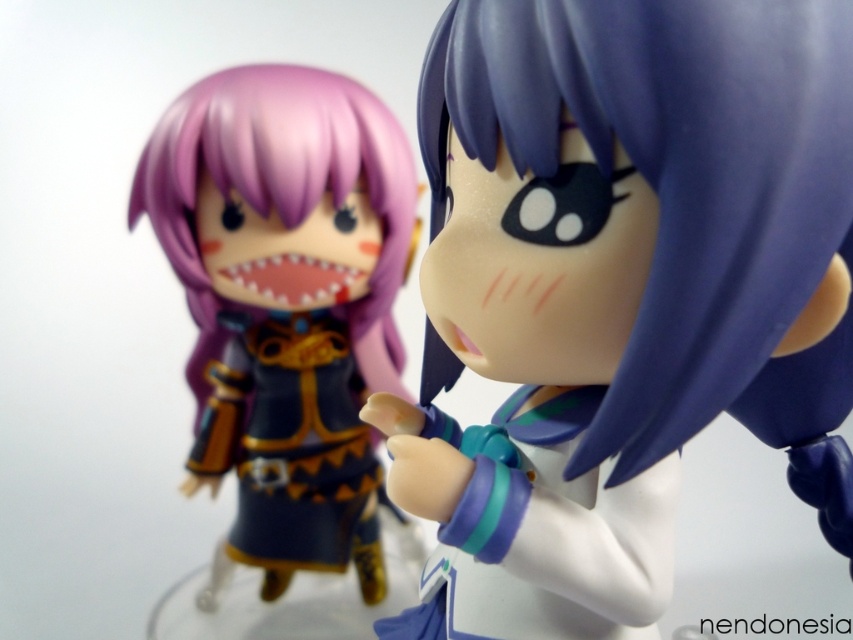
You are an art collector examining two figurines. You notice the satin purple hair at center and the matte purple hair at left. Which one is positioned closer to you?

The satin purple hair at center is closer to the viewer than the matte purple hair at left.

You are an art curator planning to display the satin purple hair at center in a glass case. The case has a height limit of 40 centimeters. Will the figurine fit vertically in the case?

The satin purple hair at center is 44.10 centimeters from viewer, which exceeds the 40 centimeter height limit of the glass case. Therefore, the figurine will not fit vertically in the case.

You are an art collector examining two figurines. You notice the satin purple hair at center and the matte purple hair at left. Which of these two has a smaller size?

The satin purple hair at center is smaller than the matte purple hair at left.